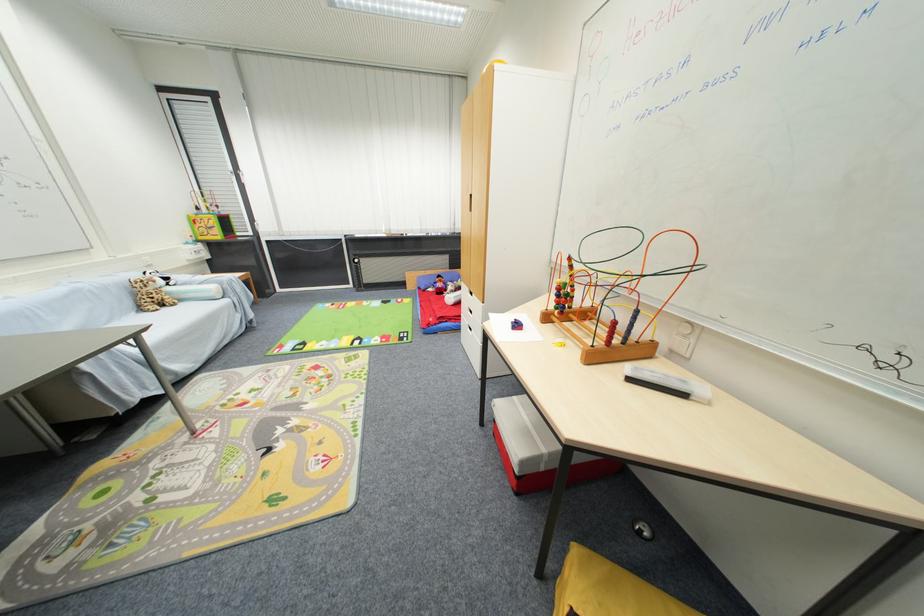
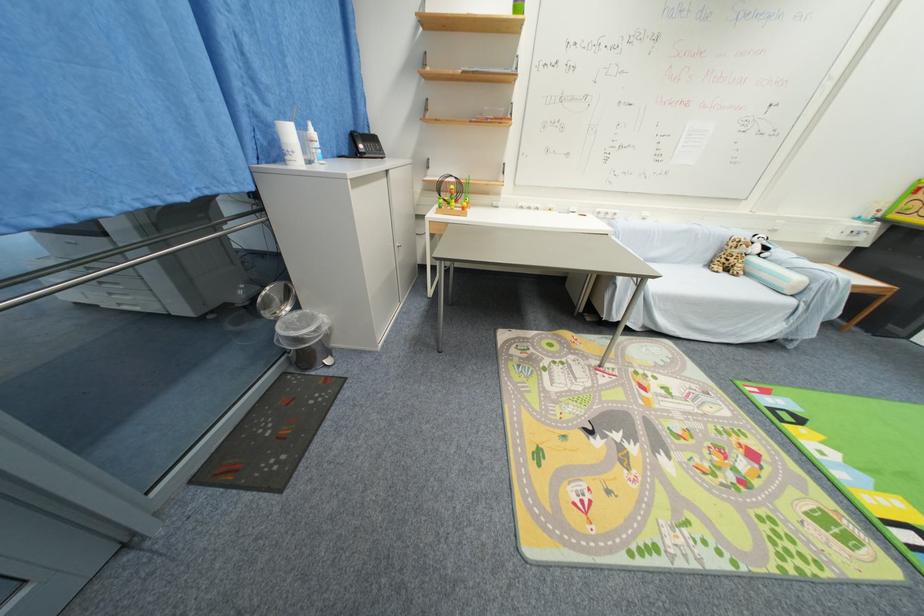
Locate, in the second image, the point that corresponds to point (146, 310) in the first image.

(714, 265)